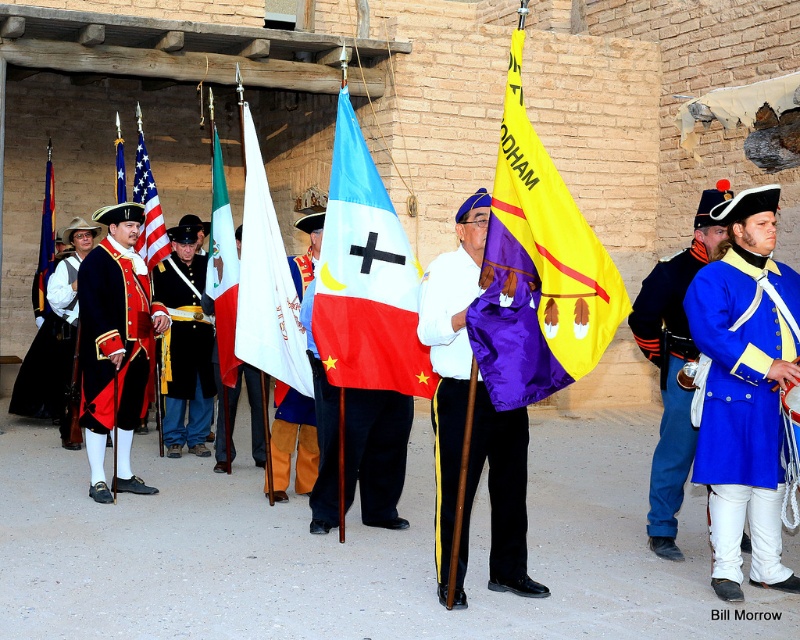
Between white fabric flag at center and matte red flag at left, which one is positioned lower?

Positioned lower is white fabric flag at center.

From the picture: Is white fabric flag at center below matte red flag at left?

Indeed, white fabric flag at center is positioned under matte red flag at left.

Who is more forward, (244, 262) or (54, 252)?

Point (244, 262)

Image resolution: width=800 pixels, height=640 pixels. I want to click on white fabric flag at center, so click(266, 282).

Is point (50, 161) positioned behind point (122, 141)?

Yes.

Image resolution: width=800 pixels, height=640 pixels. Find the location of `matte red flag at left`. matte red flag at left is located at coordinates (44, 246).

Is yellowpolyesterflag at center to the left of blue wool coat at right from the viewer's perspective?

Correct, you'll find yellowpolyesterflag at center to the left of blue wool coat at right.

Can you confirm if yellowpolyesterflag at center is bigger than blue wool coat at right?

Incorrect, yellowpolyesterflag at center is not larger than blue wool coat at right.

Locate an element on the screen. Image resolution: width=800 pixels, height=640 pixels. yellowpolyesterflag at center is located at coordinates (537, 272).